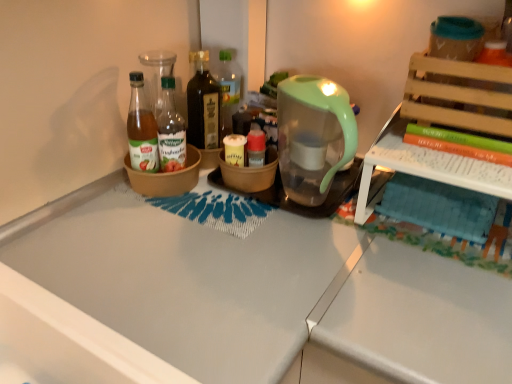
Question: Is translucent glass bottle at center, which ranks as the first bottle in right-to-left order, outside of brown ceramic bowl at center, acting as the second bowl starting from the right?

Choices:
 (A) no
 (B) yes

Answer: (B)

Question: Considering the relative sizes of translucent glass bottle at center, which ranks as the first bottle in right-to-left order, and brown ceramic bowl at center, acting as the second bowl starting from the right, in the image provided, is translucent glass bottle at center, which ranks as the first bottle in right-to-left order, taller than brown ceramic bowl at center, acting as the second bowl starting from the right,?

Choices:
 (A) yes
 (B) no

Answer: (A)

Question: From the image's perspective, is translucent glass bottle at center, which ranks as the first bottle in right-to-left order, beneath brown ceramic bowl at center, placed as the 1th bowl when sorted from left to right?

Choices:
 (A) yes
 (B) no

Answer: (B)

Question: Could you tell me if translucent glass bottle at center, acting as the 3th bottle starting from the left, is turned towards brown ceramic bowl at center, placed as the 1th bowl when sorted from left to right?

Choices:
 (A) yes
 (B) no

Answer: (B)

Question: Is translucent glass bottle at center, acting as the 3th bottle starting from the left, looking in the opposite direction of brown ceramic bowl at center, acting as the second bowl starting from the right?

Choices:
 (A) no
 (B) yes

Answer: (A)

Question: From a real-world perspective, is brown ceramic bowl at center, placed as the 1th bowl when sorted from left to right, physically located above or below brown matte bowl at center, which is the 1th bowl from right to left?

Choices:
 (A) above
 (B) below

Answer: (A)

Question: In terms of width, does brown ceramic bowl at center, acting as the second bowl starting from the right, look wider or thinner when compared to brown matte bowl at center, which is the 1th bowl from right to left?

Choices:
 (A) wide
 (B) thin

Answer: (A)

Question: From the image's perspective, is brown ceramic bowl at center, acting as the second bowl starting from the right, positioned above or below brown matte bowl at center, acting as the 2th bowl starting from the left?

Choices:
 (A) above
 (B) below

Answer: (B)

Question: Is brown ceramic bowl at center, placed as the 1th bowl when sorted from left to right, inside the boundaries of brown matte bowl at center, acting as the 2th bowl starting from the left, or outside?

Choices:
 (A) inside
 (B) outside

Answer: (B)

Question: Is dark brown glass bottle at center, the second bottle in the right-to-left sequence, in front of or behind translucent glass bottle at center, which ranks as the first bottle in right-to-left order, in the image?

Choices:
 (A) behind
 (B) front

Answer: (B)

Question: From the image's perspective, is dark brown glass bottle at center, the second bottle in the right-to-left sequence, positioned above or below translucent glass bottle at center, which ranks as the first bottle in right-to-left order?

Choices:
 (A) below
 (B) above

Answer: (A)

Question: From a real-world perspective, is dark brown glass bottle at center, the second bottle in the right-to-left sequence, positioned above or below translucent glass bottle at center, which ranks as the first bottle in right-to-left order?

Choices:
 (A) below
 (B) above

Answer: (A)

Question: Based on their positions, is dark brown glass bottle at center, the second bottle in the right-to-left sequence, located to the left or right of translucent glass bottle at center, which ranks as the first bottle in right-to-left order?

Choices:
 (A) right
 (B) left

Answer: (B)

Question: Is point (408, 130) positioned closer to the camera than point (193, 125)?

Choices:
 (A) farther
 (B) closer

Answer: (B)

Question: Is green matte book at upper right taller or shorter than dark brown glass bottle at center, the second bottle in the right-to-left sequence?

Choices:
 (A) tall
 (B) short

Answer: (B)